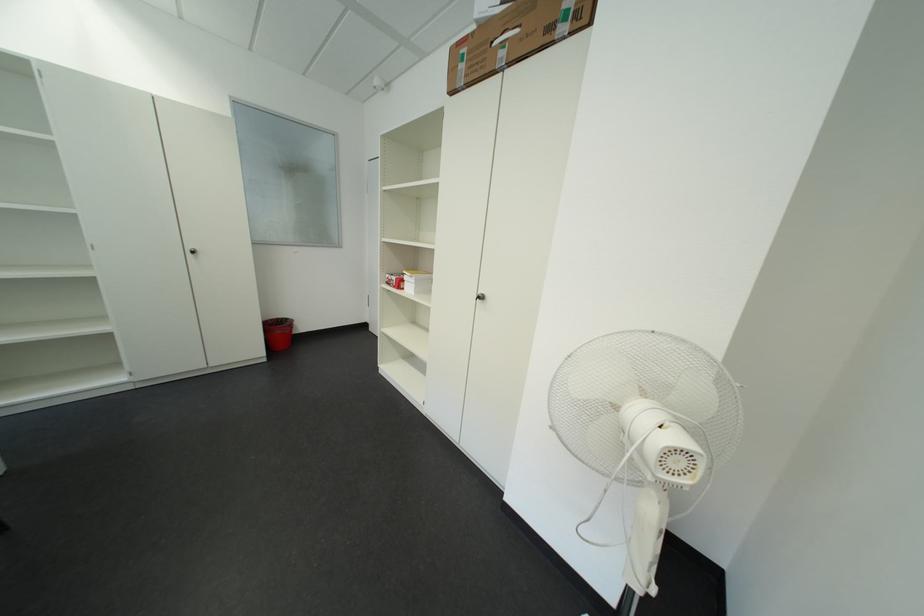
The image size is (924, 616). What are the coordinates of `small white box` in the screenshot? It's located at (417, 282).